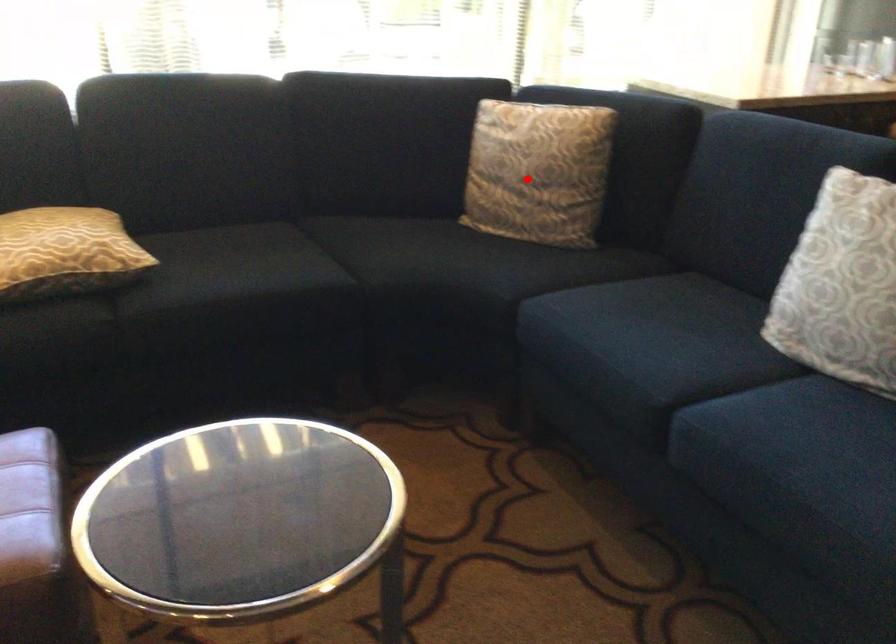
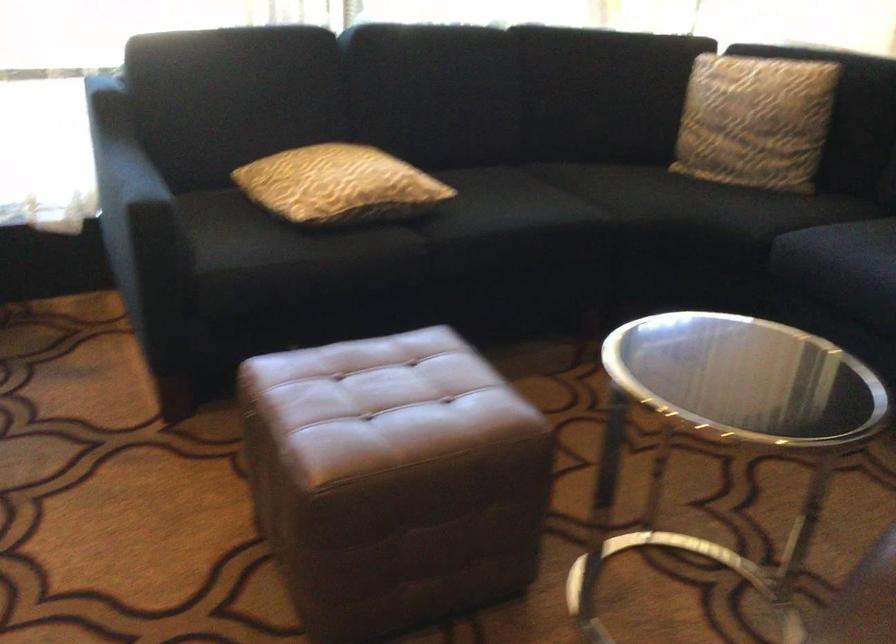
In the second image, find the point that corresponds to the highlighted location in the first image.

(754, 120)